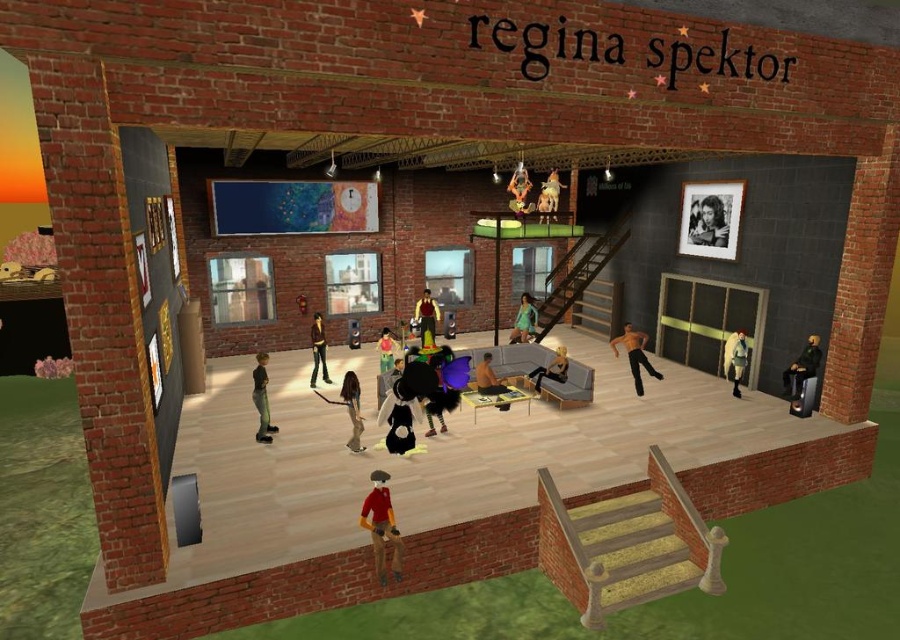
Is point (433, 396) closer to viewer compared to point (264, 390)?

Yes, it is.

Does velvet black dress at center have a lesser height compared to dark gray matte pants at center?

In fact, velvet black dress at center may be taller than dark gray matte pants at center.

I want to click on velvet black dress at center, so click(441, 388).

Does white matte jacket at right have a lesser width compared to jeans at center?

Incorrect, white matte jacket at right's width is not less than jeans at center's.

Measure the distance between white matte jacket at right and camera.

26.19 feet

Find the location of a particular element. white matte jacket at right is located at coordinates (735, 358).

Who is taller, orange fabric doll at center or green matte dress at center?

green matte dress at center

Does orange fabric doll at center appear over green matte dress at center?

Indeed, orange fabric doll at center is positioned over green matte dress at center.

Where is `orange fabric doll at center`? This screenshot has width=900, height=640. orange fabric doll at center is located at coordinates (519, 192).